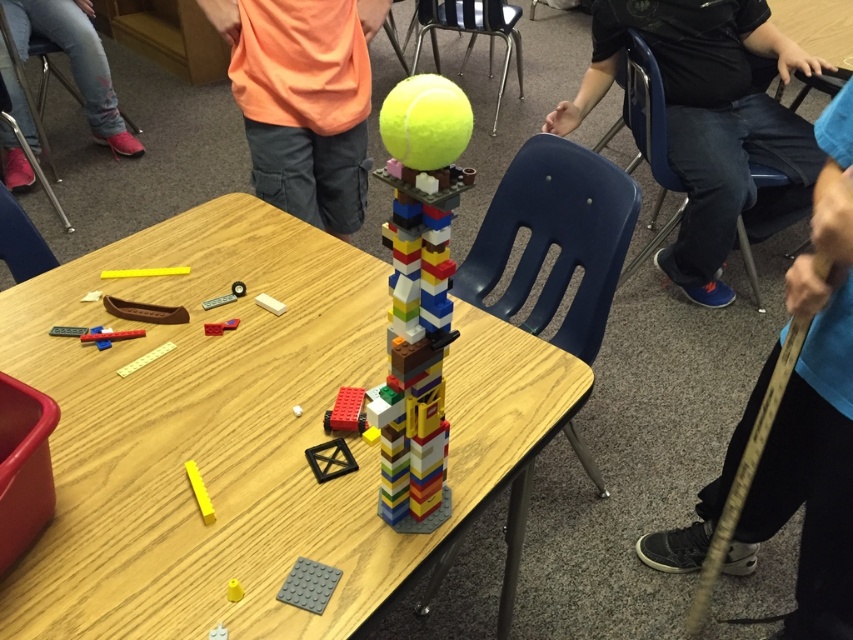
You are a student sitting at the blue plastic chair at right. You want to reach the LEGO structure on the table. Is the table within your arm reach?

The blue plastic chair at right is located at point (x=647, y=116). Since the table is at the center of the image, the distance between the chair and the table is not specified in the provided information. Therefore, it is impossible to determine if the table is within arm reach based on the given data.